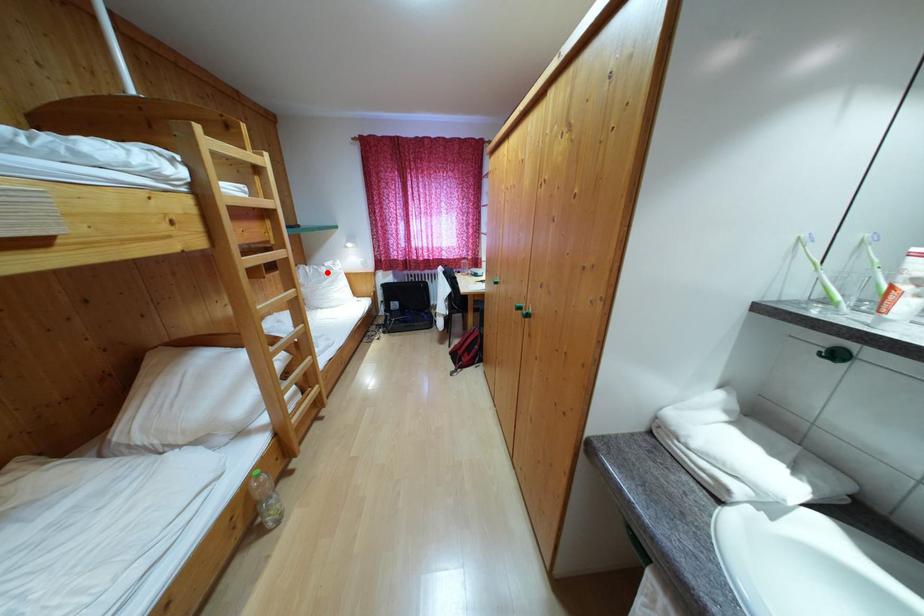
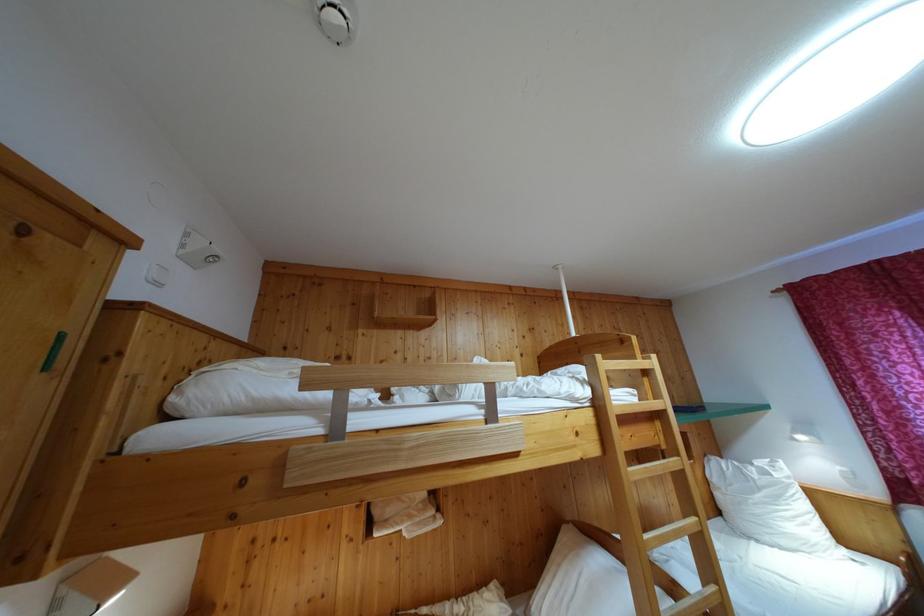
In the second image, find the point that corresponds to the highlighted location in the first image.

(755, 471)